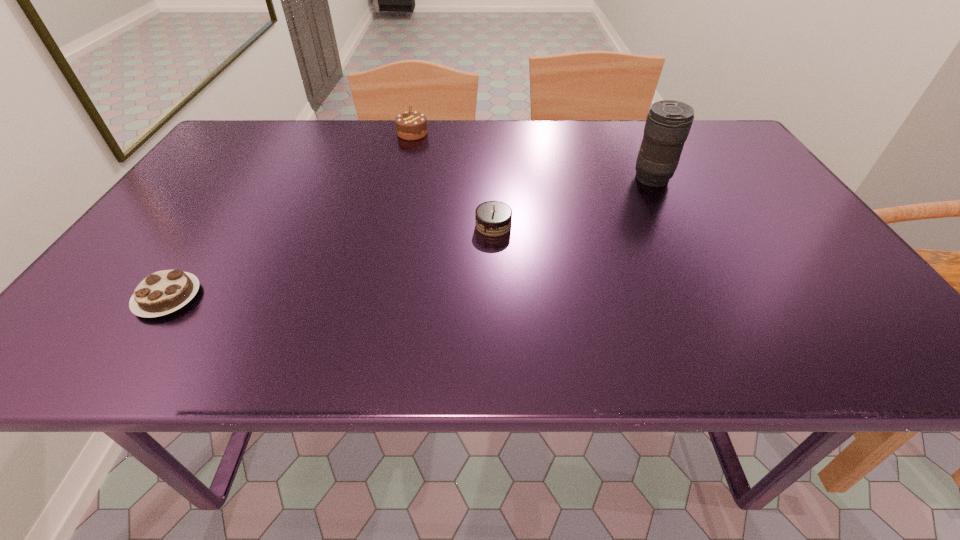
Find the location of a particular element. Image resolution: width=960 pixels, height=540 pixels. vacant area that lies between the farthest chocolate cake and the second farthest chocolate cake is located at coordinates (453, 179).

This screenshot has height=540, width=960. What are the coordinates of `vacant space in between the second farthest object and the third object from left to right` in the screenshot? It's located at (572, 202).

Where is `empty space between the second object from left to right and the shortest chocolate cake`? The image size is (960, 540). empty space between the second object from left to right and the shortest chocolate cake is located at coordinates (290, 215).

This screenshot has width=960, height=540. I want to click on vacant point located between the farthest chocolate cake and the leftmost object, so click(290, 215).

Identify the location of vacant area that lies between the farthest object and the leftmost chocolate cake. (290, 215).

Find the location of a particular element. The image size is (960, 540). free space between the second farthest chocolate cake and the shortest chocolate cake is located at coordinates (330, 261).

Find the location of `free spot between the telephoto lens and the second farthest chocolate cake`. free spot between the telephoto lens and the second farthest chocolate cake is located at coordinates (572, 202).

This screenshot has width=960, height=540. What are the coordinates of `free spot between the telephoto lens and the nearest object` in the screenshot? It's located at (410, 238).

Locate an element on the screen. free space between the telephoto lens and the nearest object is located at coordinates (410, 238).

Image resolution: width=960 pixels, height=540 pixels. What are the coordinates of `vacant point located between the shortest object and the tallest object` in the screenshot? It's located at (410, 238).